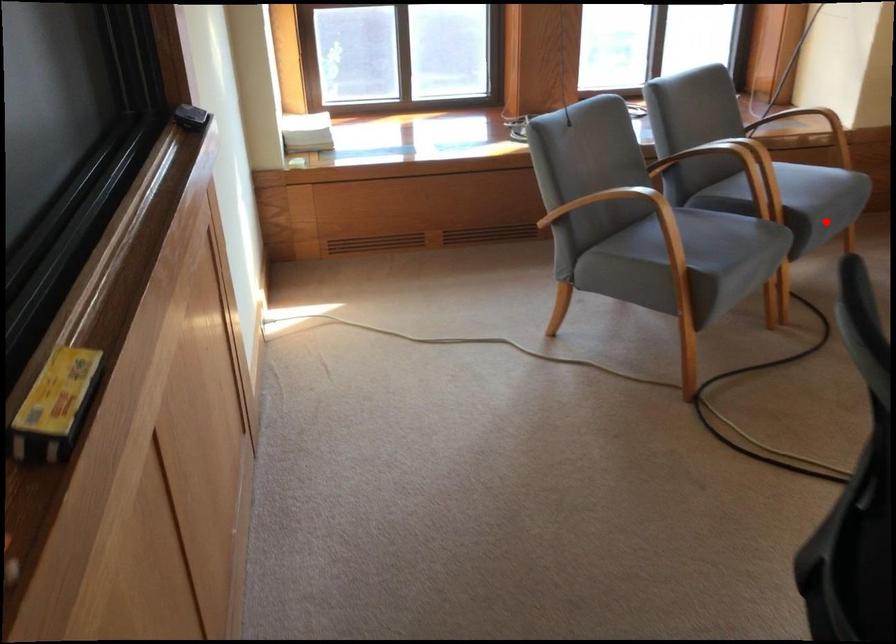
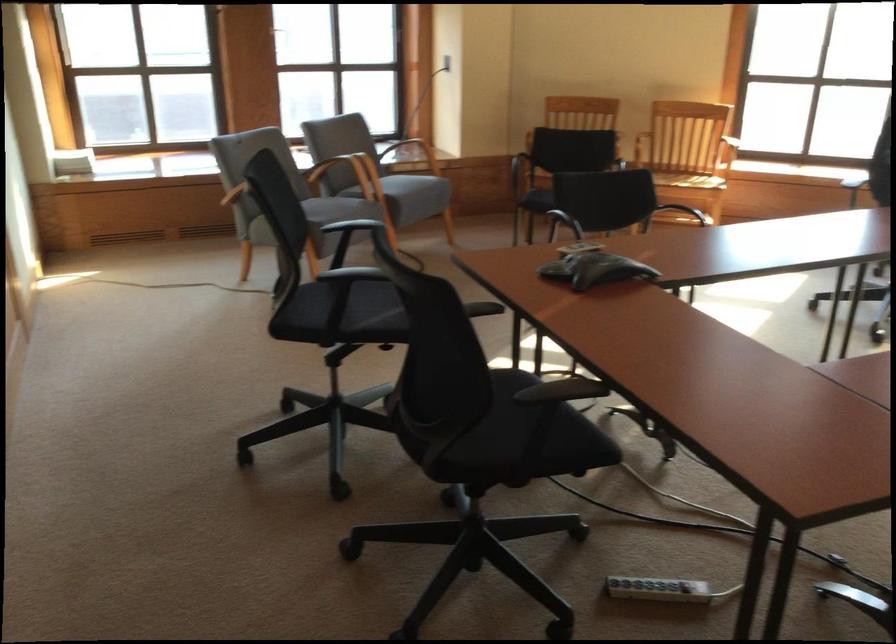
Question: I am providing you with two images of the same scene from different viewpoints. Image1 has a red point marked. In image2, the corresponding 3D location appears at what relative position? Reply with the corresponding letter.

Choices:
 (A) Closer
 (B) Farther

Answer: (B)